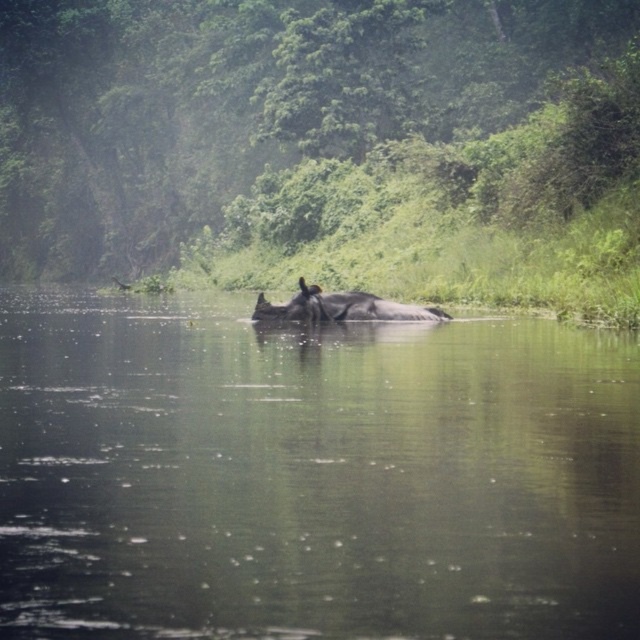
Who is more forward, (483, 589) or (186, 228)?

Point (483, 589) is more forward.

Is point (586, 627) positioned before point (529, 90)?

Yes, point (586, 627) is in front of point (529, 90).

Find the location of a particular element. The width and height of the screenshot is (640, 640). greenish murky water at center is located at coordinates (310, 474).

You are a GUI agent. You are given a task and a screenshot of the screen. Output one action in this format:
    pyautogui.click(x=<x>, y=<y>)
    Task: Click on the greenish murky water at center
    
    Given the screenshot: What is the action you would take?
    pyautogui.click(x=310, y=474)

How distant is greenish murky water at center from gray matte rhinoceros at center?

The distance of greenish murky water at center from gray matte rhinoceros at center is 3.15 meters.

Find the location of `greenish murky water at center`. greenish murky water at center is located at coordinates (310, 474).

At what (x,y) coordinates should I click in order to perform the action: click on greenish murky water at center. Please return your answer as a coordinate pair (x, y). Looking at the image, I should click on (310, 474).

Is green leafy vegetation at center wider than gray matte rhinoceros at center?

Yes, green leafy vegetation at center is wider than gray matte rhinoceros at center.

Between green leafy vegetation at center and gray matte rhinoceros at center, which one has less height?

With less height is gray matte rhinoceros at center.

Locate an element on the screen. green leafy vegetation at center is located at coordinates (326, 147).

Identify the location of green leafy vegetation at center. (326, 147).